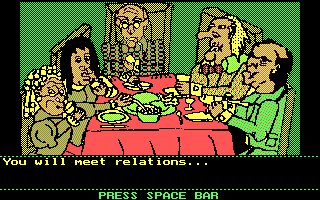
This screenshot has width=320, height=200. I want to click on bowl, so click(149, 118).